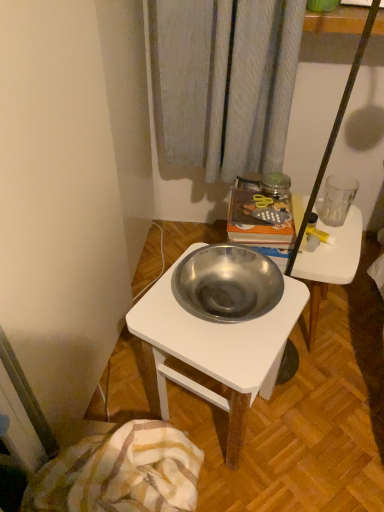
Question: From the image's perspective, is metallic silver bowl at center below plaid cotton blanket at lower left?

Choices:
 (A) yes
 (B) no

Answer: (B)

Question: From the image's perspective, would you say metallic silver bowl at center is positioned over plaid cotton blanket at lower left?

Choices:
 (A) yes
 (B) no

Answer: (A)

Question: Is metallic silver bowl at center positioned in front of plaid cotton blanket at lower left?

Choices:
 (A) no
 (B) yes

Answer: (A)

Question: Does metallic silver bowl at center appear on the left side of plaid cotton blanket at lower left?

Choices:
 (A) yes
 (B) no

Answer: (B)

Question: Considering the relative sizes of metallic silver bowl at center and plaid cotton blanket at lower left in the image provided, is metallic silver bowl at center thinner than plaid cotton blanket at lower left?

Choices:
 (A) yes
 (B) no

Answer: (A)

Question: Looking at their shapes, would you say metallic silver bowl at center is wider or thinner than metallic white desk at center?

Choices:
 (A) wide
 (B) thin

Answer: (B)

Question: Based on their positions, is metallic silver bowl at center located to the left or right of metallic white desk at center?

Choices:
 (A) left
 (B) right

Answer: (B)

Question: From a real-world perspective, is metallic silver bowl at center physically located above or below metallic white desk at center?

Choices:
 (A) above
 (B) below

Answer: (B)

Question: Which is correct: metallic silver bowl at center is inside metallic white desk at center, or outside of it?

Choices:
 (A) inside
 (B) outside

Answer: (B)

Question: Based on their sizes in the image, would you say transparent glass at right is bigger or smaller than metallic white desk at center?

Choices:
 (A) big
 (B) small

Answer: (B)

Question: Considering the positions of transparent glass at right and metallic white desk at center in the image, is transparent glass at right taller or shorter than metallic white desk at center?

Choices:
 (A) tall
 (B) short

Answer: (B)

Question: Visually, is transparent glass at right positioned to the left or to the right of metallic white desk at center?

Choices:
 (A) right
 (B) left

Answer: (A)

Question: From the image's perspective, is transparent glass at right positioned above or below metallic white desk at center?

Choices:
 (A) above
 (B) below

Answer: (A)

Question: In terms of height, does metallic white desk at center look taller or shorter compared to metallic silver bowl at center?

Choices:
 (A) tall
 (B) short

Answer: (A)

Question: In terms of size, does metallic white desk at center appear bigger or smaller than metallic silver bowl at center?

Choices:
 (A) big
 (B) small

Answer: (A)